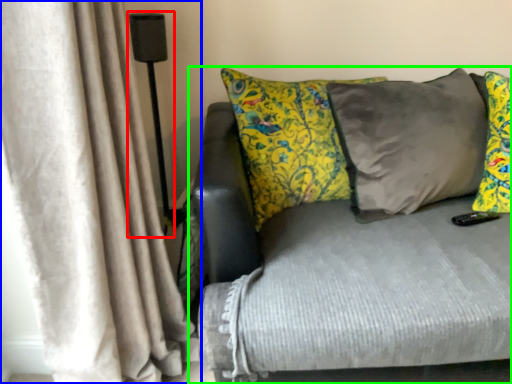
Question: Which is farther away from lamp (highlighted by a red box)? curtain (highlighted by a blue box) or studio couch (highlighted by a green box)?

Choices:
 (A) curtain
 (B) studio couch

Answer: (B)